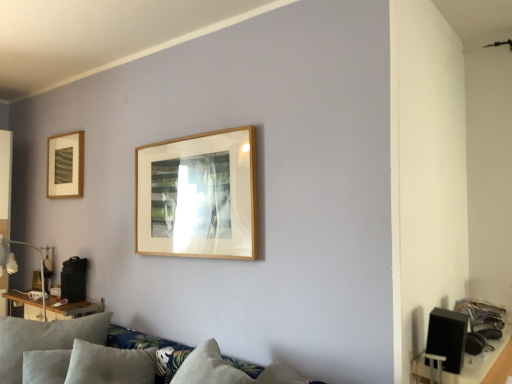
Question: Does wooden table at left appear on the left side of black matte speaker at lower right?

Choices:
 (A) no
 (B) yes

Answer: (B)

Question: Is wooden table at left touching black matte speaker at lower right?

Choices:
 (A) no
 (B) yes

Answer: (A)

Question: Does wooden table at left come in front of black matte speaker at lower right?

Choices:
 (A) yes
 (B) no

Answer: (B)

Question: Could you tell me if wooden table at left is facing black matte speaker at lower right?

Choices:
 (A) no
 (B) yes

Answer: (A)

Question: From the image's perspective, does wooden table at left appear lower than black matte speaker at lower right?

Choices:
 (A) no
 (B) yes

Answer: (B)

Question: From their relative heights in the image, would you say suede-like gray pillow at lower left is taller or shorter than matte white lamp at left?

Choices:
 (A) short
 (B) tall

Answer: (A)

Question: Is suede-like gray pillow at lower left situated inside matte white lamp at left or outside?

Choices:
 (A) inside
 (B) outside

Answer: (B)

Question: From a real-world perspective, relative to matte white lamp at left, is suede-like gray pillow at lower left vertically above or below?

Choices:
 (A) below
 (B) above

Answer: (A)

Question: Visually, is suede-like gray pillow at lower left positioned to the left or to the right of matte white lamp at left?

Choices:
 (A) right
 (B) left

Answer: (A)

Question: Considering their positions, is suede-like gray pillow at lower left located in front of or behind wooden table at left?

Choices:
 (A) front
 (B) behind

Answer: (A)

Question: Is suede-like gray pillow at lower left taller or shorter than wooden table at left?

Choices:
 (A) short
 (B) tall

Answer: (B)

Question: Do you think suede-like gray pillow at lower left is within wooden table at left, or outside of it?

Choices:
 (A) inside
 (B) outside

Answer: (B)

Question: Does point (11, 332) appear closer or farther from the camera than point (46, 301)?

Choices:
 (A) farther
 (B) closer

Answer: (B)

Question: From their relative heights in the image, would you say suede-like gray pillow at lower left is taller or shorter than soft gray fabric couch at lower left?

Choices:
 (A) tall
 (B) short

Answer: (B)

Question: From the image's perspective, is suede-like gray pillow at lower left located above or below soft gray fabric couch at lower left?

Choices:
 (A) above
 (B) below

Answer: (B)